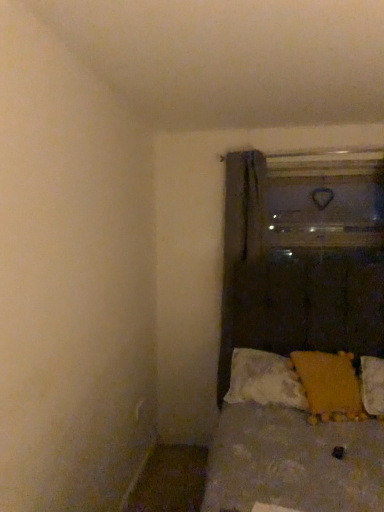
Question: Should I look upward or downward to see white textured pillow at lower right, the 2th pillow from the right?

Choices:
 (A) up
 (B) down

Answer: (B)

Question: Does dark gray fabric curtain at center have a lesser width compared to white textured pillow at lower right, the 2th pillow from the right?

Choices:
 (A) no
 (B) yes

Answer: (B)

Question: Can you confirm if dark gray fabric curtain at center is wider than white textured pillow at lower right, the 2th pillow from the right?

Choices:
 (A) no
 (B) yes

Answer: (A)

Question: Is dark gray fabric curtain at center oriented away from white textured pillow at lower right, the 2th pillow from the right?

Choices:
 (A) yes
 (B) no

Answer: (B)

Question: Is dark gray fabric curtain at center shorter than white textured pillow at lower right, the 2th pillow from the right?

Choices:
 (A) yes
 (B) no

Answer: (B)

Question: From a real-world perspective, is dark gray fabric curtain at center positioned under white textured pillow at lower right, the 2th pillow from the right, based on gravity?

Choices:
 (A) yes
 (B) no

Answer: (B)

Question: Is dark gray fabric curtain at center directly adjacent to white textured pillow at lower right, the 2th pillow from the right?

Choices:
 (A) no
 (B) yes

Answer: (A)

Question: Can you confirm if white textured pillow at lower right, the 2th pillow from the right, is smaller than transparent glass door at upper right?

Choices:
 (A) yes
 (B) no

Answer: (B)

Question: Is white textured pillow at lower right, the 2th pillow from the right, with transparent glass door at upper right?

Choices:
 (A) no
 (B) yes

Answer: (A)

Question: Does white textured pillow at lower right, the 2th pillow from the right, have a larger size compared to transparent glass door at upper right?

Choices:
 (A) no
 (B) yes

Answer: (B)

Question: From a real-world perspective, is white textured pillow at lower right, the first pillow positioned from the left, beneath transparent glass door at upper right?

Choices:
 (A) no
 (B) yes

Answer: (B)

Question: Can you confirm if white textured pillow at lower right, the first pillow positioned from the left, is thinner than transparent glass door at upper right?

Choices:
 (A) no
 (B) yes

Answer: (A)

Question: Can transparent glass door at upper right be found inside white textured pillow at lower right, the first pillow positioned from the left?

Choices:
 (A) no
 (B) yes

Answer: (A)

Question: Is yellow fabric pillow at lower right, placed as the second pillow when sorted from left to right, located within transparent glass door at upper right?

Choices:
 (A) no
 (B) yes

Answer: (A)